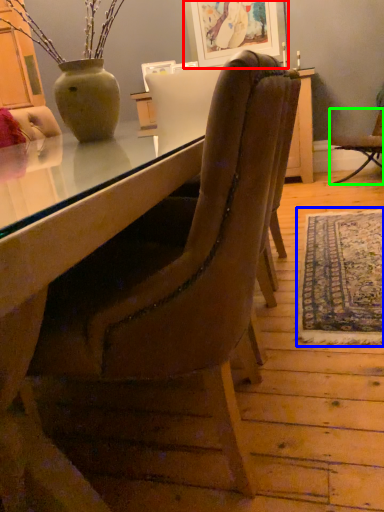
Question: Which is nearer to the picture frame (highlighted by a red box)? mat (highlighted by a blue box) or chair (highlighted by a green box).

Choices:
 (A) mat
 (B) chair

Answer: (B)